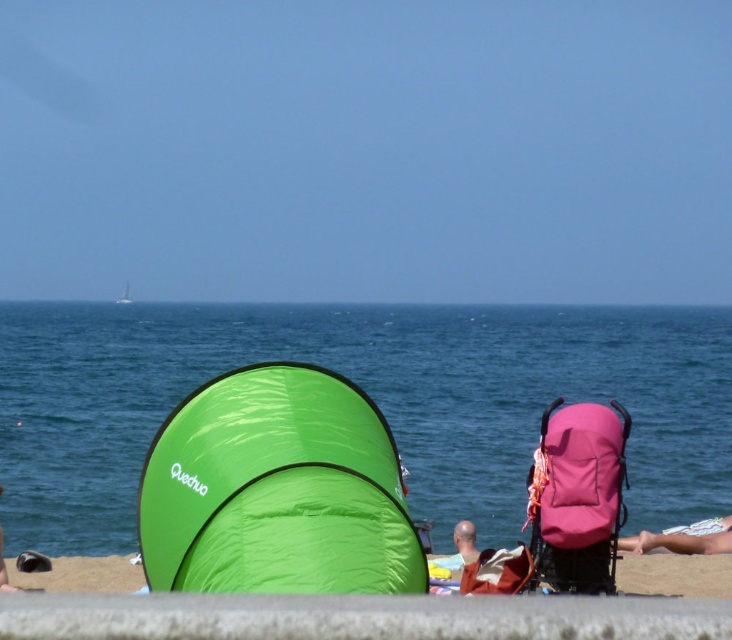
Where is `green fabric tent at lower center`? Image resolution: width=732 pixels, height=640 pixels. green fabric tent at lower center is located at coordinates (358, 616).

Image resolution: width=732 pixels, height=640 pixels. Identify the location of green fabric tent at lower center. (358, 616).

Where is `green fabric tent at lower center`? The height and width of the screenshot is (640, 732). green fabric tent at lower center is located at coordinates (358, 616).

Between point (722, 547) and point (468, 557), which one is positioned behind?

Point (722, 547)

Between point (635, 545) and point (452, 531), which one is positioned behind?

Point (452, 531)

Find the location of a particular element. Image resolution: width=732 pixels, height=640 pixels. pink fabric towel at lower right is located at coordinates (683, 538).

Can you confirm if pink fabric stroller at right is thinner than smooth bald head at center?

Yes, pink fabric stroller at right is thinner than smooth bald head at center.

Describe the element at coordinates (578, 497) in the screenshot. I see `pink fabric stroller at right` at that location.

Where is `pink fabric stroller at right`? This screenshot has width=732, height=640. pink fabric stroller at right is located at coordinates (578, 497).